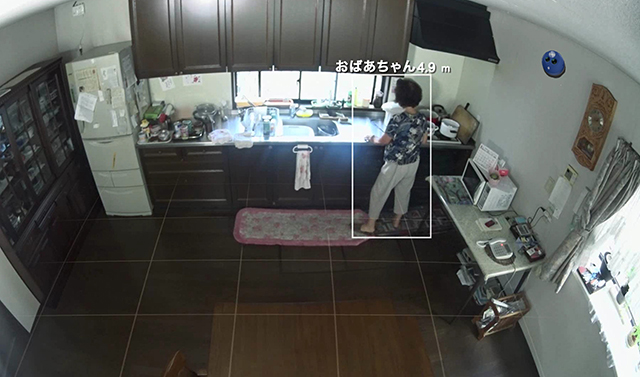
This screenshot has width=640, height=377. I want to click on rug, so click(x=272, y=224).